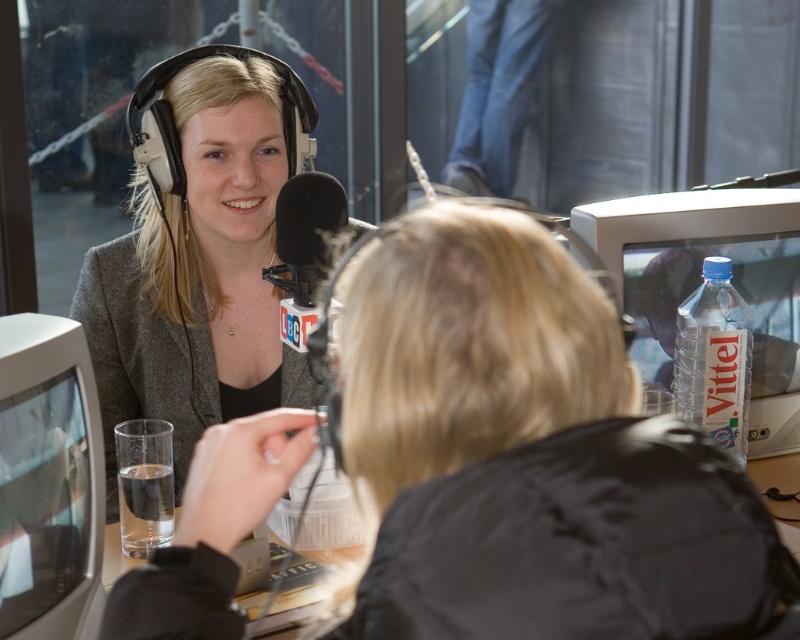
You are a technician in the studio and need to locate the white glossy computer monitor at left. According to the studio layout, where would you find it?

The white glossy computer monitor at left is located at point (48, 476).

You are a technician in a radio studio. You need to place a new equipment box that is 30 inches long between the clear plastic monitor at upper right and the white glossy computer monitor at left. Can you fit it without overlapping either monitor?

The distance between the clear plastic monitor at upper right and the white glossy computer monitor at left is 36.23 inches. Since the equipment box is 30 inches long, it can fit between them as there is enough space.

You are setting up a radio studio and need to place a new decorative item between the white glossy computer monitor at left and the black matte microphone at center. Which object should you place the item closer to if you want it to be near the smaller object?

The black matte microphone at center is smaller than the white glossy computer monitor at left, so you should place the item closer to the black matte microphone at center.